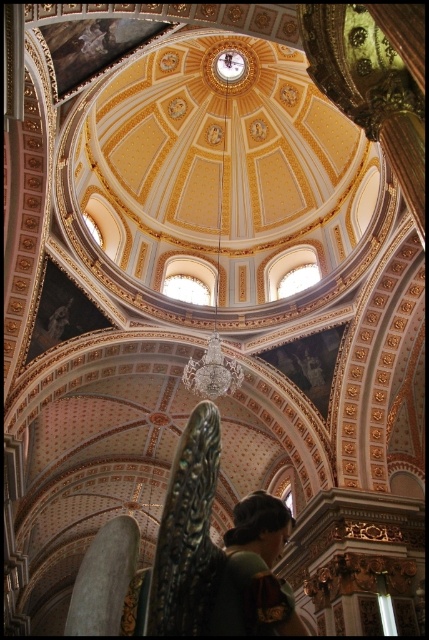
You are standing inside the grand cathedral and want to take a photo of the point at coordinates point (247,634). Your camera has a maximum focus range of 30 meters. Will you be able to focus on the point?

The point (247,634) is 28.74 meters away from the camera, which is within the 30 meters maximum focus range. Yes, the camera can focus on the point.

You are standing in the grand cathedral and looking up at the dome. You notice two points marked on the dome at coordinates point [224,540] and point [232,388]. Which point is closer to your eyes?

Point [224,540] is closer to the camera than point [232,388].

You are standing in the cathedral and want to place a small flower vase on the floor directly under the gold metallic chandelier at center. Is the green fabric headscarf at lower center currently blocking that spot?

The green fabric headscarf at lower center is located below the gold metallic chandelier at center, so it is blocking the spot where you want to place the flower vase.